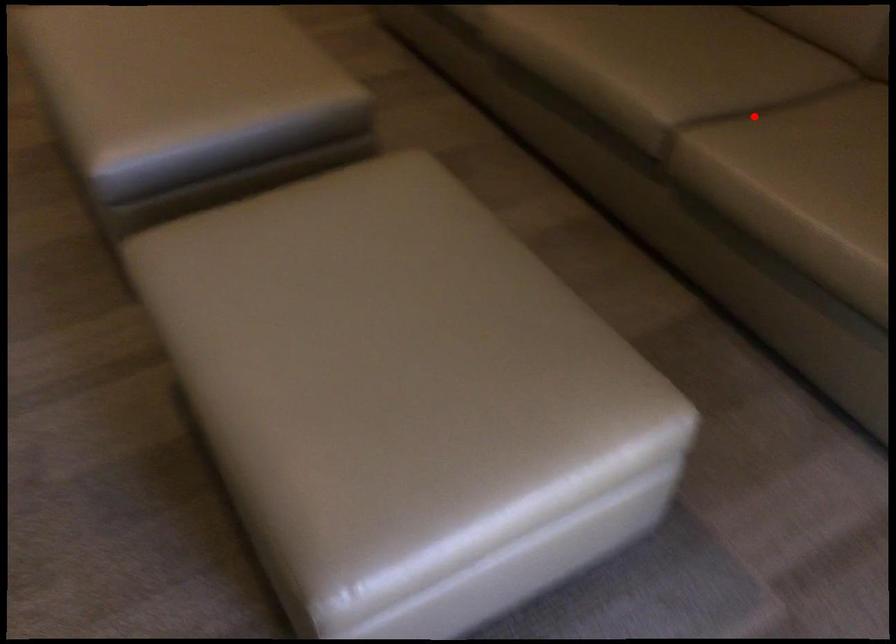
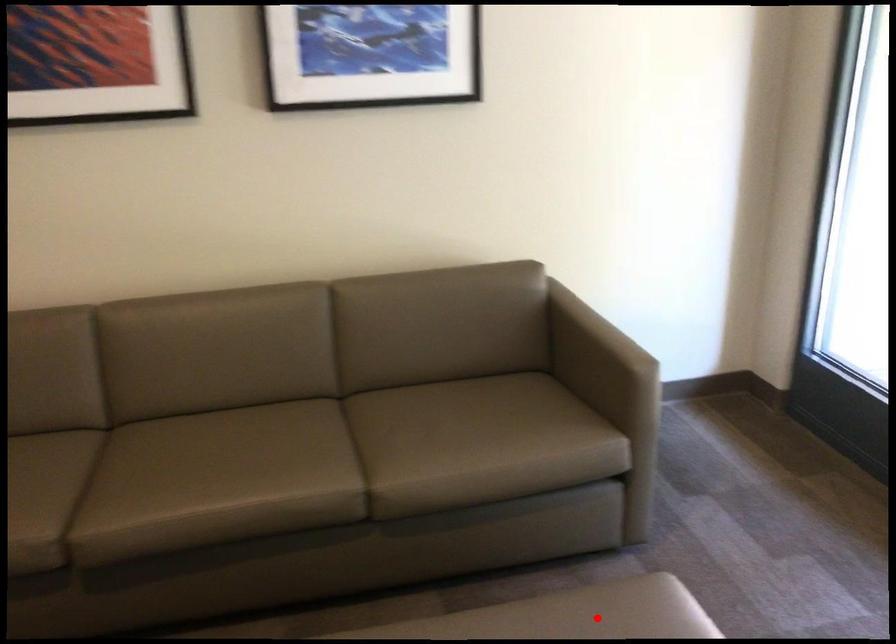
I am providing you with two images of the same scene from different viewpoints. A red point is marked on the first image and another point is marked on the second image. Is the marked point in image1 the same physical position as the marked point in image2?

No